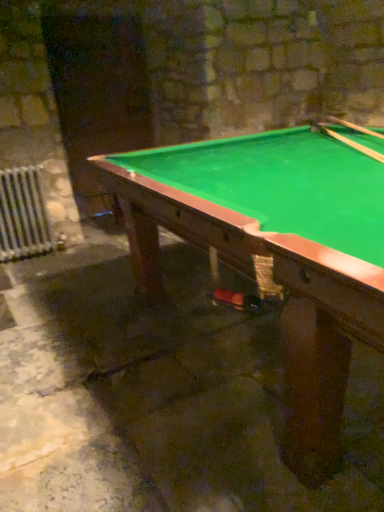
What is the approximate height of green felt pool table at center?

green felt pool table at center is 35.11 inches in height.

Identify the location of wooden smooth cue at upper right, the 2th cue viewed from the left. (354, 126).

Image resolution: width=384 pixels, height=512 pixels. What are the coordinates of `green felt pool table at center` in the screenshot? It's located at (274, 253).

Can you confirm if white metal radiator at lower left is taller than wooden smooth cue at upper right, the 2th cue viewed from the left?

Yes, white metal radiator at lower left is taller than wooden smooth cue at upper right, the 2th cue viewed from the left.

From the image's perspective, is white metal radiator at lower left on top of wooden smooth cue at upper right, the 2th cue viewed from the left?

No, from the image's perspective, white metal radiator at lower left is not over wooden smooth cue at upper right, the 2th cue viewed from the left.

Is the position of white metal radiator at lower left more distant than that of wooden smooth cue at upper right, placed as the first cue when sorted from right to left?

Yes, white metal radiator at lower left is further from the camera.

Is wooden smooth cue at upper right, the 2th cue viewed from the left, at the back of white metal radiator at lower left?

white metal radiator at lower left does not have its back to wooden smooth cue at upper right, the 2th cue viewed from the left.

From a real-world perspective, is wooden cue at upper right, the 2th cue when ordered from right to left, positioned above or below green felt pool table at center?

Clearly, from a real-world perspective, wooden cue at upper right, the 2th cue when ordered from right to left, is above green felt pool table at center.

In terms of width, does wooden cue at upper right, the 2th cue when ordered from right to left, look wider or thinner when compared to green felt pool table at center?

Considering their sizes, wooden cue at upper right, the 2th cue when ordered from right to left, looks slimmer than green felt pool table at center.

Is point (343, 139) positioned after point (363, 278)?

Yes.

Is green felt pool table at center wider than wooden smooth cue at upper right, placed as the first cue when sorted from right to left?

Yes, green felt pool table at center is wider than wooden smooth cue at upper right, placed as the first cue when sorted from right to left.

Is green felt pool table at center touching wooden smooth cue at upper right, placed as the first cue when sorted from right to left?

green felt pool table at center is not next to wooden smooth cue at upper right, placed as the first cue when sorted from right to left, and they're not touching.

Between green felt pool table at center and wooden smooth cue at upper right, placed as the first cue when sorted from right to left, which one has less height?

With less height is wooden smooth cue at upper right, placed as the first cue when sorted from right to left.

You are a GUI agent. You are given a task and a screenshot of the screen. Output one action in this format:
    pyautogui.click(x=<x>, y=<y>)
    Task: Click on the cue in front of the wooden smooth cue at upper right, the 2th cue viewed from the left
    The image size is (384, 512).
    Given the screenshot: What is the action you would take?
    pyautogui.click(x=347, y=141)

Based on their positions, is wooden smooth cue at upper right, the 2th cue viewed from the left, located to the left or right of wooden cue at upper right, arranged as the 1th cue when viewed from the left?

wooden smooth cue at upper right, the 2th cue viewed from the left, is positioned on wooden cue at upper right, arranged as the 1th cue when viewed from the left,'s right side.

Between wooden smooth cue at upper right, the 2th cue viewed from the left, and wooden cue at upper right, the 2th cue when ordered from right to left, which one is positioned in front?

wooden cue at upper right, the 2th cue when ordered from right to left, is closer to the camera.

Which is in front, point (361, 131) or point (336, 133)?

Positioned in front is point (336, 133).

From a real-world perspective, relative to green felt pool table at center, is wooden smooth cue at upper right, the 2th cue viewed from the left, vertically above or below?

wooden smooth cue at upper right, the 2th cue viewed from the left, is above green felt pool table at center.

Which is in front, point (346, 122) or point (320, 228)?

Positioned in front is point (320, 228).

Is wooden smooth cue at upper right, the 2th cue viewed from the left, in front of or behind green felt pool table at center in the image?

wooden smooth cue at upper right, the 2th cue viewed from the left, is positioned farther from the viewer than green felt pool table at center.

Is white metal radiator at lower left positioned behind wooden cue at upper right, arranged as the 1th cue when viewed from the left?

Yes, it is behind wooden cue at upper right, arranged as the 1th cue when viewed from the left.

Could you tell me if white metal radiator at lower left is facing wooden cue at upper right, the 2th cue when ordered from right to left?

No, white metal radiator at lower left is not facing towards wooden cue at upper right, the 2th cue when ordered from right to left.

Which is nearer, (38, 246) or (323, 131)?

Point (38, 246).

Consider the image. Between white metal radiator at lower left and wooden cue at upper right, the 2th cue when ordered from right to left, which one has larger width?

Wider between the two is wooden cue at upper right, the 2th cue when ordered from right to left.

Are green felt pool table at center and wooden cue at upper right, the 2th cue when ordered from right to left, located far from each other?

No, green felt pool table at center is not far from wooden cue at upper right, the 2th cue when ordered from right to left.

From a real-world perspective, between green felt pool table at center and wooden cue at upper right, arranged as the 1th cue when viewed from the left, who is vertically higher?

wooden cue at upper right, arranged as the 1th cue when viewed from the left, is physically above.

Is green felt pool table at center at the left side of wooden cue at upper right, arranged as the 1th cue when viewed from the left?

Yes, green felt pool table at center is to the left of wooden cue at upper right, arranged as the 1th cue when viewed from the left.

Do you think green felt pool table at center is within wooden cue at upper right, arranged as the 1th cue when viewed from the left, or outside of it?

green felt pool table at center lies outside wooden cue at upper right, arranged as the 1th cue when viewed from the left.

I want to click on the 1st cue in front of the white metal radiator at lower left, starting your count from the anchor, so click(x=354, y=126).

Image resolution: width=384 pixels, height=512 pixels. I want to click on billiard table on the left of wooden cue at upper right, arranged as the 1th cue when viewed from the left, so click(274, 253).

Estimate the real-world distances between objects in this image. Which object is further from wooden cue at upper right, arranged as the 1th cue when viewed from the left, green felt pool table at center or white metal radiator at lower left?

white metal radiator at lower left lies further to wooden cue at upper right, arranged as the 1th cue when viewed from the left, than the other object.

Looking at the image, which one is located further to white metal radiator at lower left, green felt pool table at center or wooden cue at upper right, the 2th cue when ordered from right to left?

Among the two, wooden cue at upper right, the 2th cue when ordered from right to left, is located further to white metal radiator at lower left.

Which object lies further to the anchor point wooden cue at upper right, arranged as the 1th cue when viewed from the left, white metal radiator at lower left or green felt pool table at center?

Among the two, white metal radiator at lower left is located further to wooden cue at upper right, arranged as the 1th cue when viewed from the left.

Estimate the real-world distances between objects in this image. Which object is closer to wooden cue at upper right, arranged as the 1th cue when viewed from the left, white metal radiator at lower left or wooden smooth cue at upper right, the 2th cue viewed from the left?

wooden smooth cue at upper right, the 2th cue viewed from the left, is positioned closer to the anchor wooden cue at upper right, arranged as the 1th cue when viewed from the left.

From the image, which object appears to be nearer to white metal radiator at lower left, wooden smooth cue at upper right, placed as the first cue when sorted from right to left, or wooden cue at upper right, the 2th cue when ordered from right to left?

The object closer to white metal radiator at lower left is wooden cue at upper right, the 2th cue when ordered from right to left.

Estimate the real-world distances between objects in this image. Which object is further from wooden smooth cue at upper right, the 2th cue viewed from the left, wooden cue at upper right, the 2th cue when ordered from right to left, or green felt pool table at center?

Based on the image, green felt pool table at center appears to be further to wooden smooth cue at upper right, the 2th cue viewed from the left.

From the image, which object appears to be nearer to green felt pool table at center, wooden cue at upper right, arranged as the 1th cue when viewed from the left, or wooden smooth cue at upper right, placed as the first cue when sorted from right to left?

wooden cue at upper right, arranged as the 1th cue when viewed from the left, is positioned closer to the anchor green felt pool table at center.

Which object lies nearer to the anchor point green felt pool table at center, wooden smooth cue at upper right, placed as the first cue when sorted from right to left, or white metal radiator at lower left?

wooden smooth cue at upper right, placed as the first cue when sorted from right to left, is positioned closer to the anchor green felt pool table at center.

Identify the location of cue located between green felt pool table at center and wooden smooth cue at upper right, placed as the first cue when sorted from right to left, in the depth direction. This screenshot has width=384, height=512. (347, 141).

Where is `billiard table located between white metal radiator at lower left and wooden cue at upper right, arranged as the 1th cue when viewed from the left, in the left-right direction`? Image resolution: width=384 pixels, height=512 pixels. billiard table located between white metal radiator at lower left and wooden cue at upper right, arranged as the 1th cue when viewed from the left, in the left-right direction is located at coordinates (274, 253).

Identify the location of billiard table situated between white metal radiator at lower left and wooden smooth cue at upper right, the 2th cue viewed from the left, from left to right. Image resolution: width=384 pixels, height=512 pixels. [x=274, y=253].

Where is `cue located between white metal radiator at lower left and wooden smooth cue at upper right, placed as the first cue when sorted from right to left, in the left-right direction`? cue located between white metal radiator at lower left and wooden smooth cue at upper right, placed as the first cue when sorted from right to left, in the left-right direction is located at coordinates (347, 141).